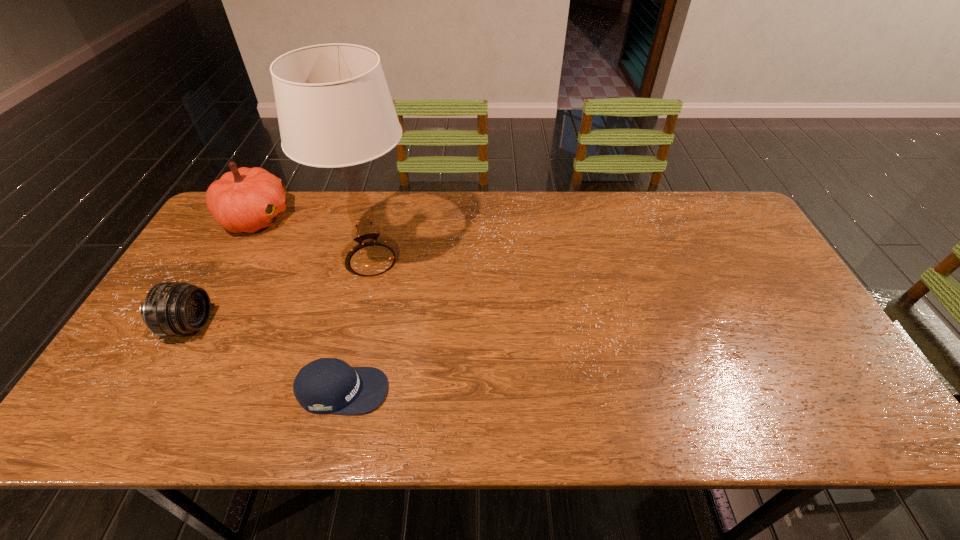
Find the location of a particular element. This screenshot has height=540, width=960. table lamp is located at coordinates (334, 108).

The width and height of the screenshot is (960, 540). Identify the location of the second tallest object. (245, 199).

Locate an element on the screen. The image size is (960, 540). telephoto lens is located at coordinates (170, 309).

Locate an element on the screen. The image size is (960, 540). the second shortest object is located at coordinates (170, 309).

This screenshot has height=540, width=960. Find the location of `the nearest object`. the nearest object is located at coordinates (327, 385).

Identify the location of baseball cap. This screenshot has width=960, height=540. (327, 385).

At what (x,y) coordinates should I click in order to perform the action: click on vacant region located 0.230m on the front-facing side of the tallest object. Please return your answer as a coordinate pair (x, y). The width and height of the screenshot is (960, 540). Looking at the image, I should click on [x=495, y=260].

The width and height of the screenshot is (960, 540). Identify the location of vacant space positioned on the front-facing side of the second tallest object. (337, 217).

The image size is (960, 540). I want to click on vacant area situated 0.170m at the front element of the second shortest object, so click(x=275, y=326).

Where is `vacant area situated on the front-facing side of the nearest object`? vacant area situated on the front-facing side of the nearest object is located at coordinates (562, 390).